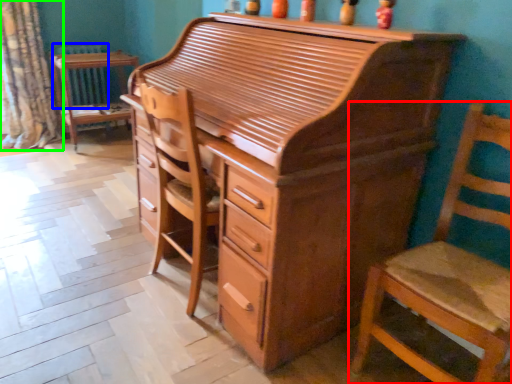
Question: Estimate the real-world distances between objects in this image. Which object is closer to chair (highlighted by a red box), radiator (highlighted by a blue box) or curtain (highlighted by a green box)?

Choices:
 (A) radiator
 (B) curtain

Answer: (B)